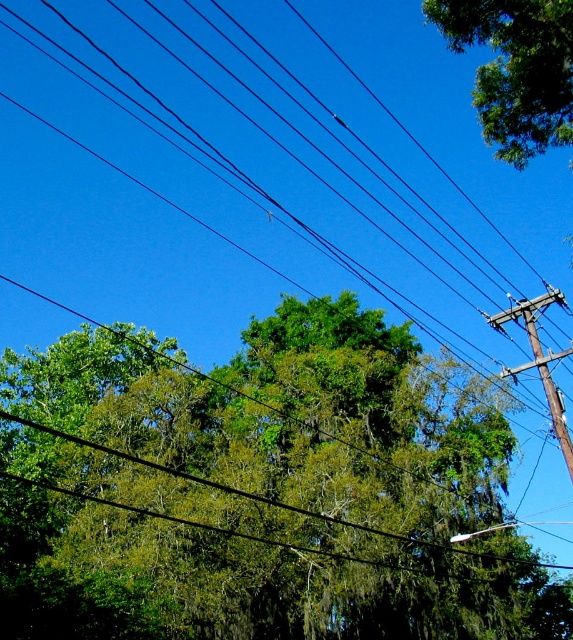
In the scene shown: Can you confirm if green leafy tree at center is thinner than green leafy tree at upper right?

No.

Find the location of a particular element. This screenshot has width=573, height=640. green leafy tree at center is located at coordinates (262, 490).